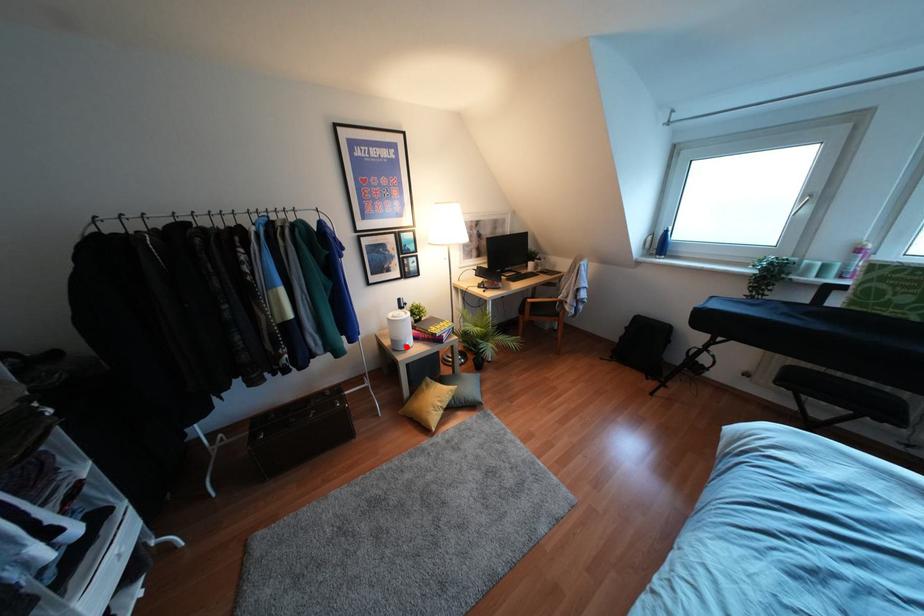
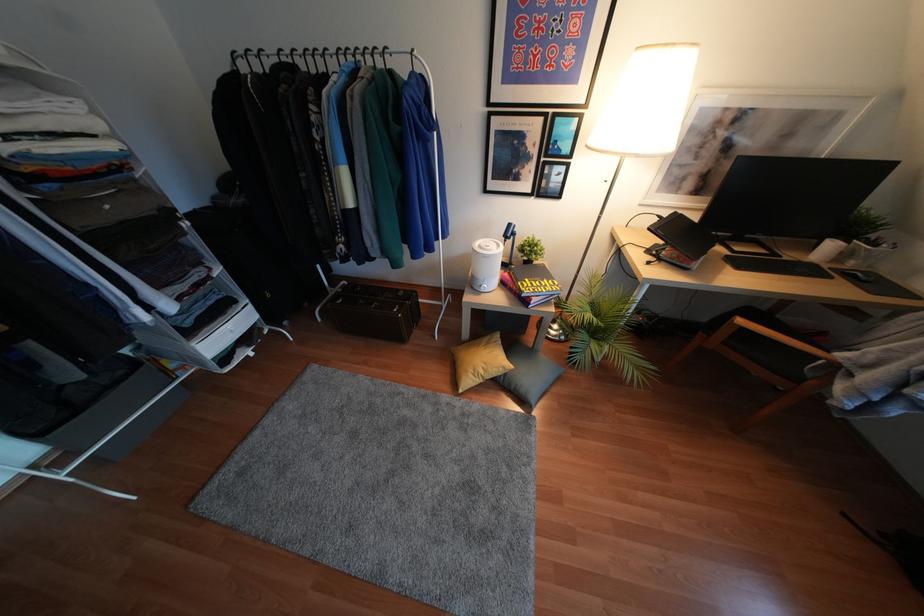
Locate, in the second image, the point that corresponds to the highlighted location in the first image.

(481, 290)